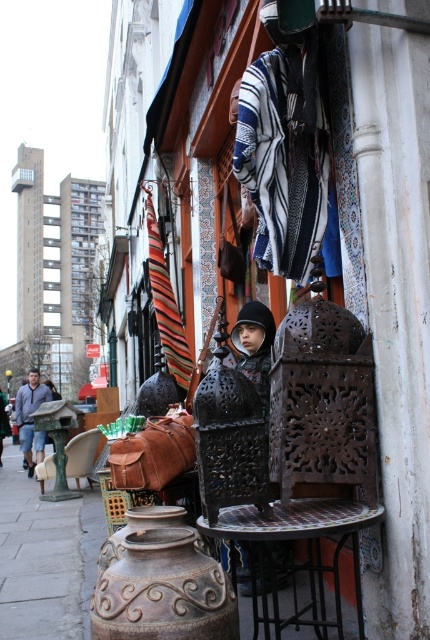
Question: Which object is positioned farthest from the denim jacket at left?

Choices:
 (A) rustic metal table at center
 (B) green fabric chair at center

Answer: (A)

Question: Among these objects, which one is nearest to the camera?

Choices:
 (A) rustic metal table at center
 (B) green fabric chair at center
 (C) denim jacket at left

Answer: (A)

Question: Is rustic metal table at center positioned in front of denim jacket at left?

Choices:
 (A) no
 (B) yes

Answer: (B)

Question: Which point is farther from the camera taking this photo?

Choices:
 (A) (17, 417)
 (B) (70, 472)

Answer: (A)

Question: Can you confirm if denim jacket at left is positioned to the right of green fabric chair at center?

Choices:
 (A) yes
 (B) no

Answer: (B)

Question: Does denim jacket at left have a larger size compared to green fabric chair at center?

Choices:
 (A) yes
 (B) no

Answer: (A)